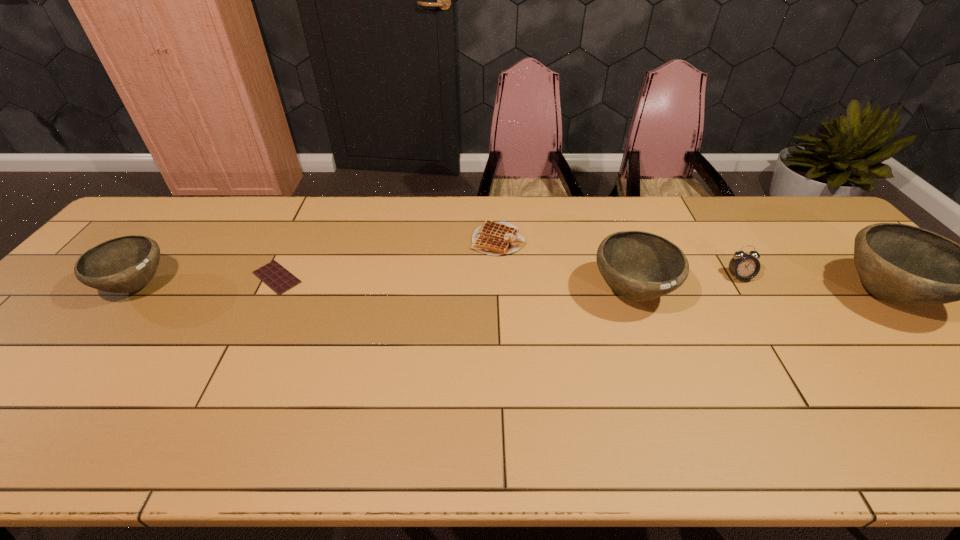
You are a GUI agent. You are given a task and a screenshot of the screen. Output one action in this format:
    pyautogui.click(x=<x>, y=<y>)
    Task: Click on the fourth shortest object
    
    Given the screenshot: What is the action you would take?
    pyautogui.click(x=125, y=264)

Locate an element on the screen. This screenshot has height=540, width=960. the shortest bowl is located at coordinates (125, 264).

Where is `the second bowl from left to right`? The height and width of the screenshot is (540, 960). the second bowl from left to right is located at coordinates (639, 266).

You are a GUI agent. You are given a task and a screenshot of the screen. Output one action in this format:
    pyautogui.click(x=<x>, y=<y>)
    Task: Click on the fifth shortest object
    
    Given the screenshot: What is the action you would take?
    [639, 266]

Find the location of a particular element. This screenshot has width=960, height=540. the second shortest object is located at coordinates (492, 238).

This screenshot has height=540, width=960. What are the coordinates of `waffle` in the screenshot? It's located at (492, 238).

Identify the location of the shortest object. This screenshot has height=540, width=960. (275, 276).

Identify the location of chocolate bar. (275, 276).

The height and width of the screenshot is (540, 960). Identify the location of alarm clock. (744, 266).

This screenshot has width=960, height=540. In order to click on the second object from right to left in this screenshot , I will do `click(744, 266)`.